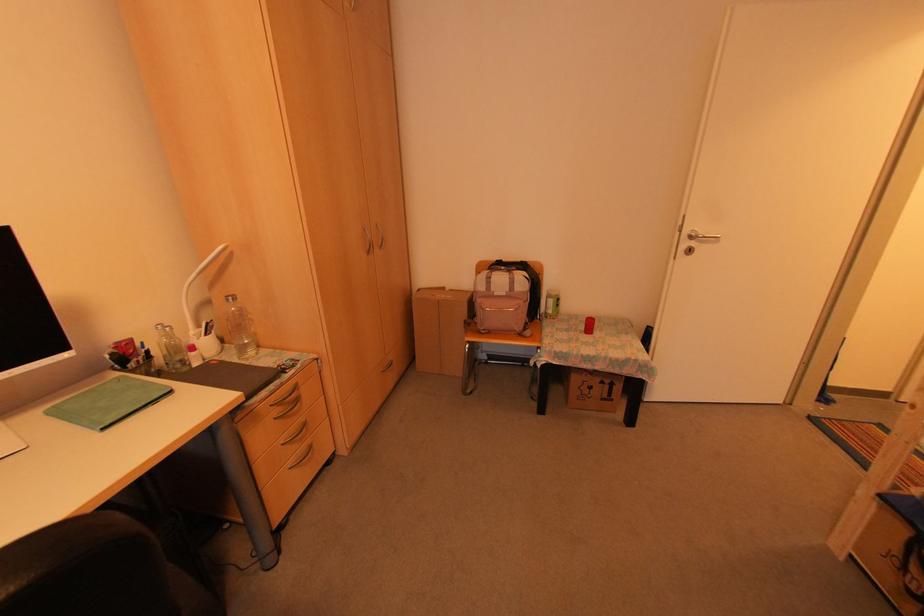
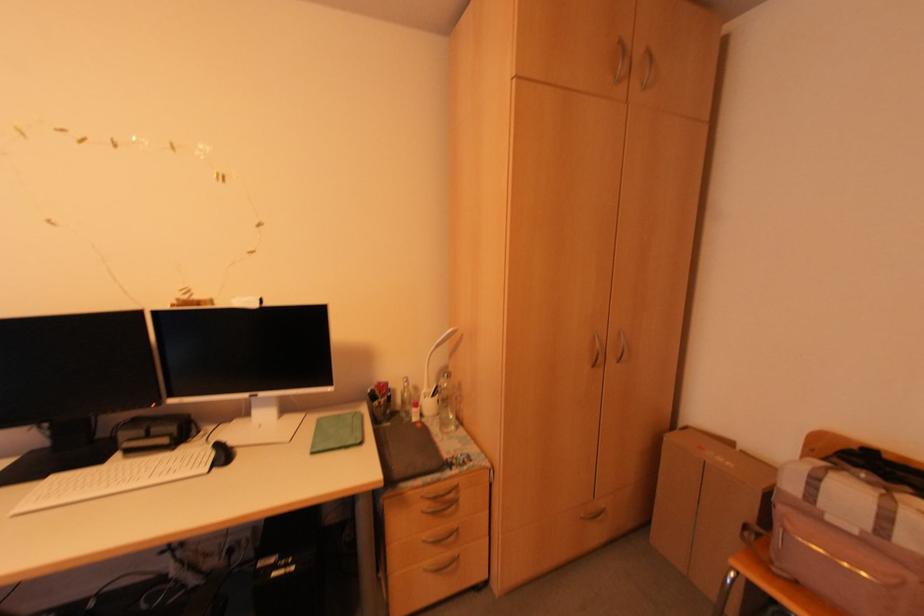
Where in the second image is the point corresponding to the point at 294,387 from the first image?

(455, 488)